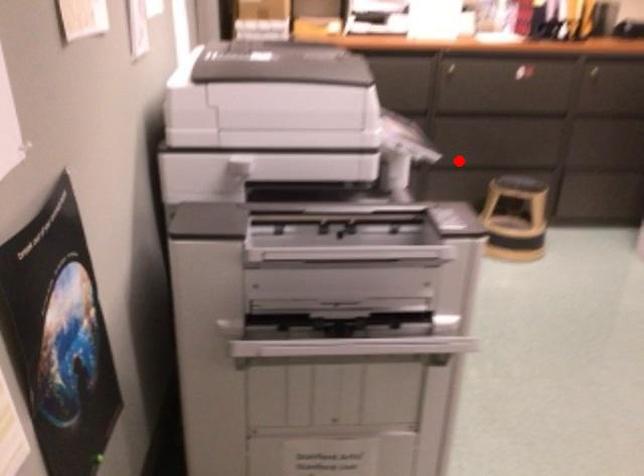
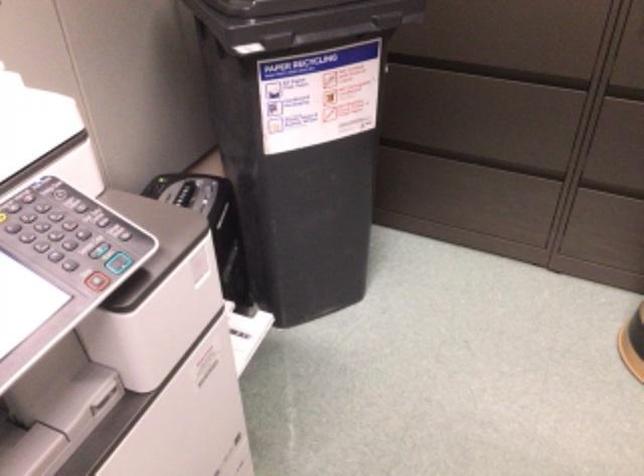
Find the pixel in the second image that matches the highlighted location in the first image.

(614, 180)